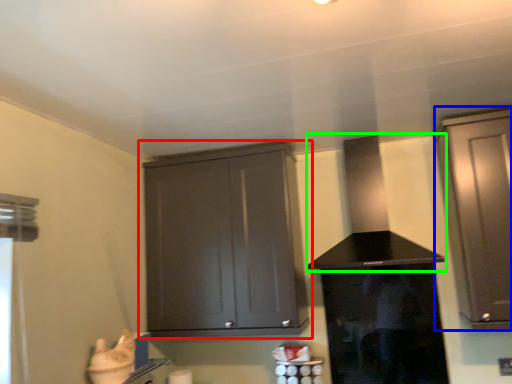
Question: Which object is positioned farthest from cabinetry (highlighted by a red box)? Select from cabinetry (highlighted by a blue box) and vent (highlighted by a green box).

Choices:
 (A) cabinetry
 (B) vent

Answer: (A)